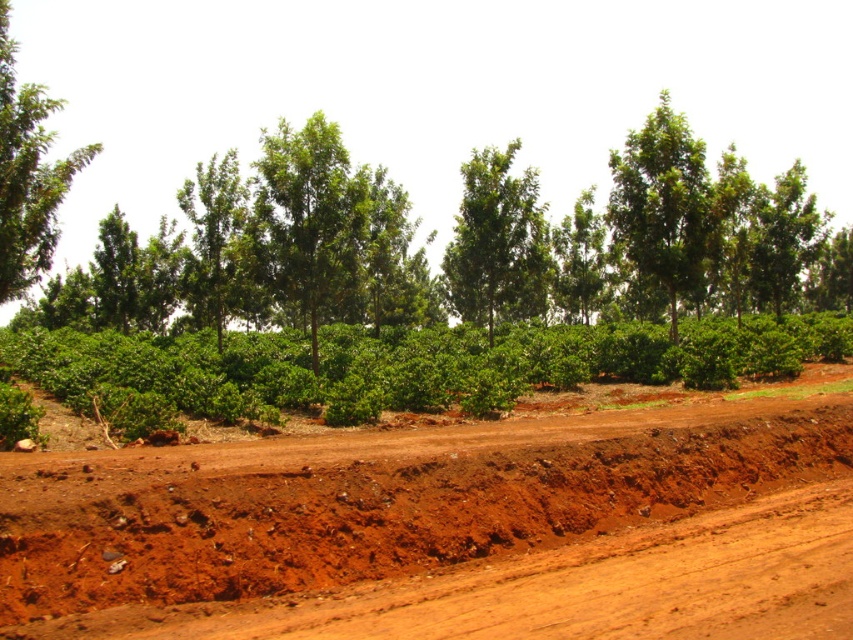
Is the position of green leafy tree at upper right less distant than that of green leafy tree at upper left?

No, green leafy tree at upper right is behind green leafy tree at upper left.

Does green leafy tree at upper right have a larger size compared to green leafy tree at upper left?

Incorrect, green leafy tree at upper right is not larger than green leafy tree at upper left.

Who is more forward, (650,221) or (9,83)?

Positioned in front is point (9,83).

Identify the location of green leafy tree at upper right. This screenshot has width=853, height=640. (662, 204).

Does brown soil at center appear under green leafy tree at upper left?

Correct, brown soil at center is located below green leafy tree at upper left.

From the picture: Can you confirm if brown soil at center is taller than green leafy tree at upper left?

No.

What do you see at coordinates (451, 525) in the screenshot?
I see `brown soil at center` at bounding box center [451, 525].

Identify the location of brown soil at center. The height and width of the screenshot is (640, 853). click(451, 525).

Who is taller, brown soil at center or green leafy tree at center?

With more height is green leafy tree at center.

Is brown soil at center closer to the viewer compared to green leafy tree at center?

That is True.

Is point (221, 493) behind point (532, 273)?

No, (221, 493) is in front of (532, 273).

This screenshot has width=853, height=640. I want to click on brown soil at center, so click(451, 525).